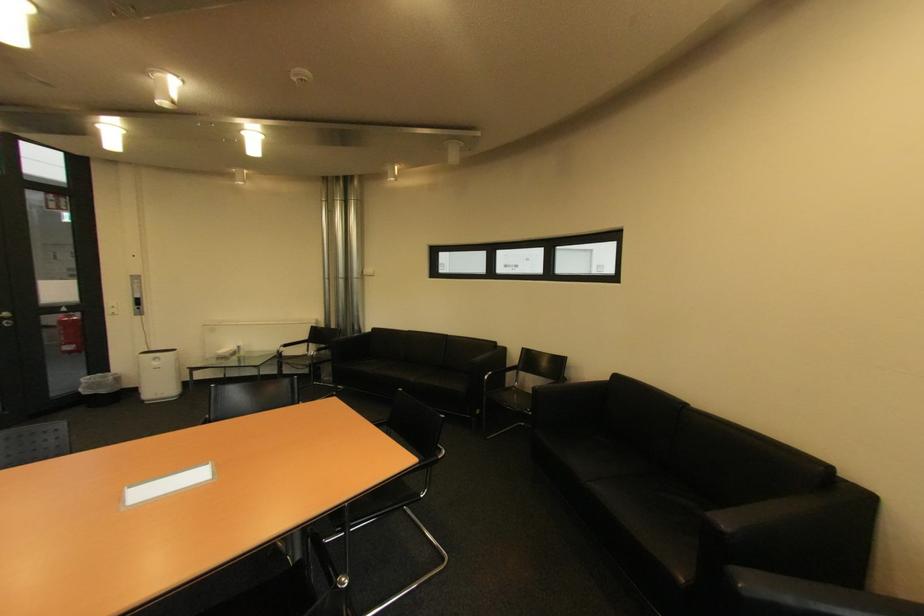
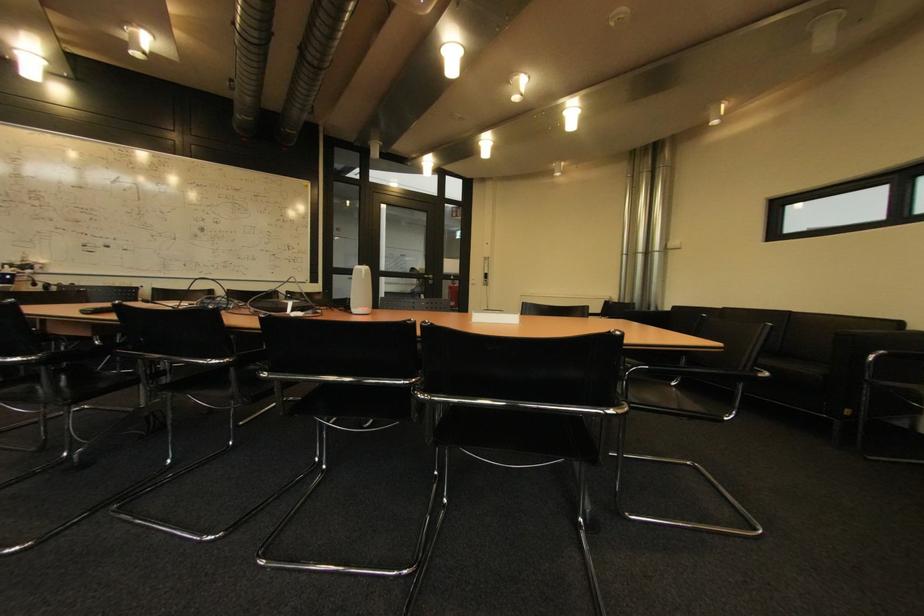
Find the pixel in the second image that matches point (61, 310) in the first image.

(456, 278)